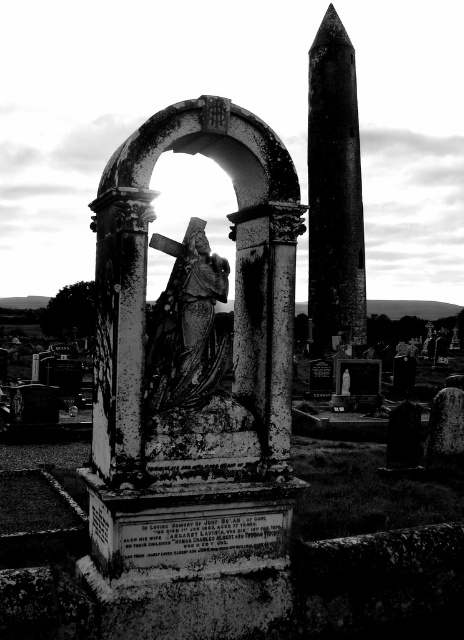
Question: Which object appears farthest from the camera in this image?

Choices:
 (A) rusty metal statue at center
 (B) smooth stone pillar at upper right

Answer: (B)

Question: Among these objects, which one is farthest from the camera?

Choices:
 (A) smooth stone pillar at upper right
 (B) rusty metal statue at center

Answer: (A)

Question: Can you confirm if smooth stone pillar at upper right is positioned to the left of rusty metal statue at center?

Choices:
 (A) yes
 (B) no

Answer: (B)

Question: Does smooth stone pillar at upper right have a larger size compared to rusty metal statue at center?

Choices:
 (A) no
 (B) yes

Answer: (B)

Question: Which point is farther to the camera?

Choices:
 (A) (316, 42)
 (B) (207, 376)

Answer: (A)

Question: Can you confirm if smooth stone pillar at upper right is bigger than rusty metal statue at center?

Choices:
 (A) no
 (B) yes

Answer: (B)